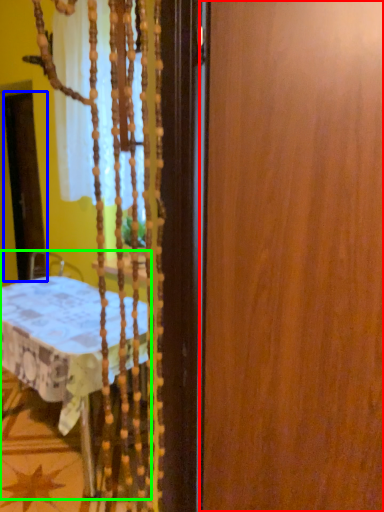
Question: Which object is positioned closest to barn door (highlighted by a red box)? Select from screen door (highlighted by a blue box) and furniture (highlighted by a green box).

Choices:
 (A) screen door
 (B) furniture

Answer: (B)